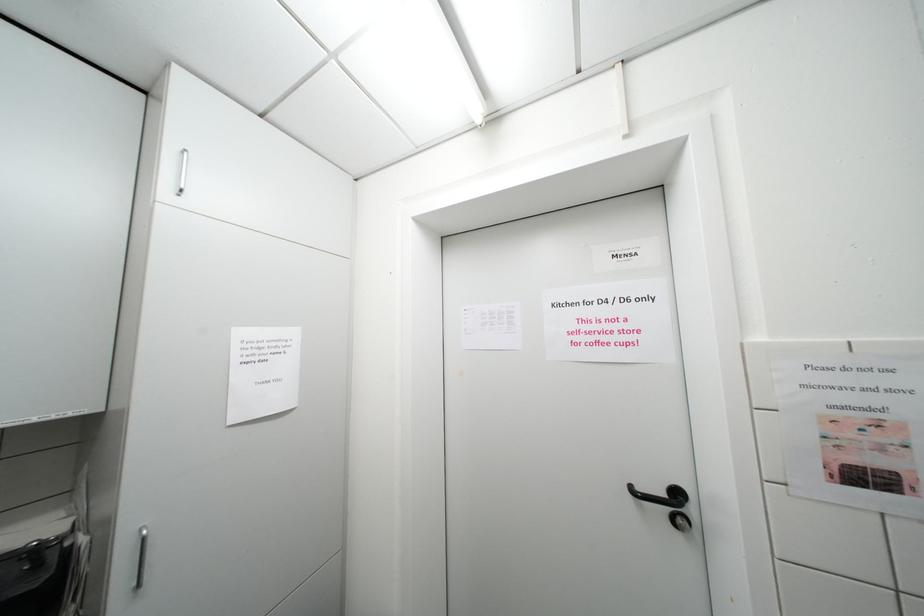
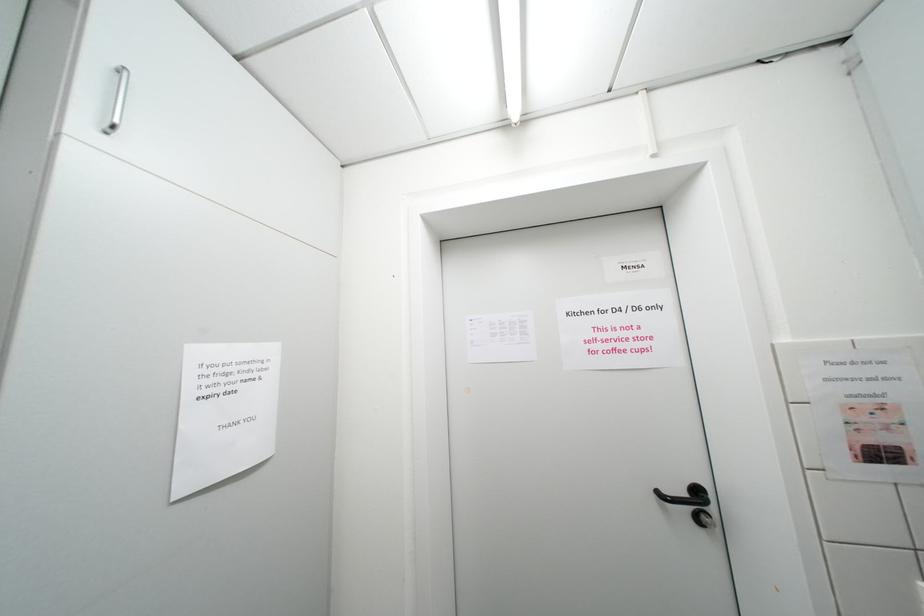
Question: The camera is either moving clockwise (left) or counter-clockwise (right) around the object. The first image is from the beginning of the video and the second image is from the end. Is the camera moving left or right when shooting the video?

Choices:
 (A) Left
 (B) Right

Answer: (A)